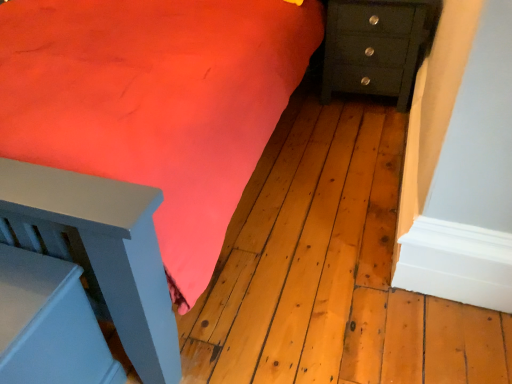
This screenshot has height=384, width=512. What do you see at coordinates (375, 46) in the screenshot? I see `matte black chest of drawers at right` at bounding box center [375, 46].

The width and height of the screenshot is (512, 384). Identify the location of matte black chest of drawers at right. (375, 46).

Locate an element on the screen. matte black chest of drawers at right is located at coordinates (375, 46).